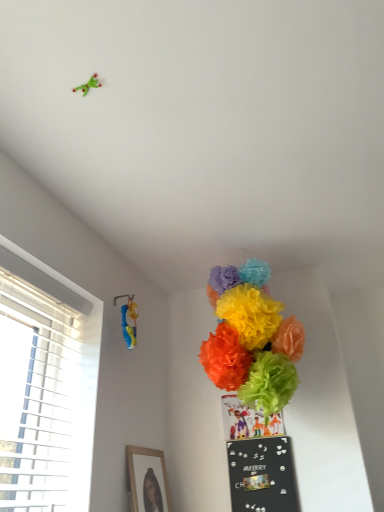
Find the location of a particular element. black matte bulletin board at lower center is located at coordinates (262, 475).

Where is `blue plastic toy at upper left`? The width and height of the screenshot is (384, 512). blue plastic toy at upper left is located at coordinates (131, 318).

Locate an element on the screen. black matte bulletin board at lower center is located at coordinates (262, 475).

Is point (131, 347) positioned behind point (248, 298)?

Yes, it is.

Is bright tissue paper pom-poms at center surrounded by blue plastic toy at upper left?

No, blue plastic toy at upper left does not contain bright tissue paper pom-poms at center.

Between blue plastic toy at upper left and bright tissue paper pom-poms at center, which one has smaller width?

blue plastic toy at upper left.

From a real-world perspective, is blue plastic toy at upper left below bright tissue paper pom-poms at center?

Yes.

Can you confirm if wooden framed picture at lower left is smaller than blue plastic toy at upper left?

No, wooden framed picture at lower left is not smaller than blue plastic toy at upper left.

From a real-world perspective, is wooden framed picture at lower left above or below blue plastic toy at upper left?

In terms of real-world spatial position, wooden framed picture at lower left is below blue plastic toy at upper left.

From the image's perspective, relative to blue plastic toy at upper left, is wooden framed picture at lower left above or below?

wooden framed picture at lower left is below blue plastic toy at upper left.

Considering the relative sizes of wooden framed picture at lower left and blue plastic toy at upper left in the image provided, is wooden framed picture at lower left shorter than blue plastic toy at upper left?

In fact, wooden framed picture at lower left may be taller than blue plastic toy at upper left.

In the scene shown: Between bright tissue paper pom-poms at center and wooden framed picture at lower left, which one has less height?

wooden framed picture at lower left is shorter.

Considering the sizes of bright tissue paper pom-poms at center and wooden framed picture at lower left in the image, is bright tissue paper pom-poms at center bigger or smaller than wooden framed picture at lower left?

Considering their sizes, bright tissue paper pom-poms at center takes up more space than wooden framed picture at lower left.

Is bright tissue paper pom-poms at center situated inside wooden framed picture at lower left or outside?

bright tissue paper pom-poms at center is located beyond the bounds of wooden framed picture at lower left.

Looking at this image, measure the distance between bright tissue paper pom-poms at center and wooden framed picture at lower left.

66.80 centimeters.

Are wooden framed picture at lower left and black matte bulletin board at lower center far apart?

No, wooden framed picture at lower left is not far from black matte bulletin board at lower center.

In terms of height, does wooden framed picture at lower left look taller or shorter compared to black matte bulletin board at lower center?

wooden framed picture at lower left is shorter than black matte bulletin board at lower center.

Based on the photo, from a real-world perspective, between wooden framed picture at lower left and black matte bulletin board at lower center, who is vertically lower?

From a 3D spatial view, black matte bulletin board at lower center is below.

What's the angular difference between wooden framed picture at lower left and black matte bulletin board at lower center's facing directions?

89.7 degrees separate the facing orientations of wooden framed picture at lower left and black matte bulletin board at lower center.

Is the depth of bright tissue paper pom-poms at center less than that of black matte bulletin board at lower center?

Yes, bright tissue paper pom-poms at center is closer to the viewer.

Is bright tissue paper pom-poms at center directly adjacent to black matte bulletin board at lower center?

bright tissue paper pom-poms at center and black matte bulletin board at lower center are not in contact.

Is bright tissue paper pom-poms at center to the left of black matte bulletin board at lower center from the viewer's perspective?

Yes, bright tissue paper pom-poms at center is to the left of black matte bulletin board at lower center.

Considering the relative sizes of bright tissue paper pom-poms at center and black matte bulletin board at lower center in the image provided, is bright tissue paper pom-poms at center thinner than black matte bulletin board at lower center?

Incorrect, the width of bright tissue paper pom-poms at center is not less than that of black matte bulletin board at lower center.

From the image's perspective, is black matte bulletin board at lower center located above wooden framed picture at lower left?

Incorrect, from the image's perspective, black matte bulletin board at lower center is lower than wooden framed picture at lower left.

From a real-world perspective, is black matte bulletin board at lower center physically above wooden framed picture at lower left?

Incorrect, from a real-world perspective, black matte bulletin board at lower center is lower than wooden framed picture at lower left.

Is black matte bulletin board at lower center far from wooden framed picture at lower left?

No.

Is black matte bulletin board at lower center smaller than wooden framed picture at lower left?

Indeed, black matte bulletin board at lower center has a smaller size compared to wooden framed picture at lower left.

Which point is more distant from viewer, (x=115, y=303) or (x=259, y=468)?

The point (x=115, y=303) is farther.

Between blue plastic toy at upper left and black matte bulletin board at lower center, which one has larger size?

Bigger between the two is black matte bulletin board at lower center.

From the picture: Who is taller, blue plastic toy at upper left or black matte bulletin board at lower center?

black matte bulletin board at lower center is taller.

In the scene shown: Considering the relative positions of blue plastic toy at upper left and black matte bulletin board at lower center in the image provided, is blue plastic toy at upper left in front of black matte bulletin board at lower center?

Yes, blue plastic toy at upper left is closer to the camera.

Where is `toy located behind the bright tissue paper pom-poms at center`? This screenshot has width=384, height=512. toy located behind the bright tissue paper pom-poms at center is located at coordinates 131,318.

Locate an element on the screen. Image resolution: width=384 pixels, height=512 pixels. picture frame located in front of the blue plastic toy at upper left is located at coordinates (148, 479).

Considering their positions, is wooden framed picture at lower left positioned closer to blue plastic toy at upper left than bright tissue paper pom-poms at center?

bright tissue paper pom-poms at center lies closer to blue plastic toy at upper left than the other object.

When comparing their distances from wooden framed picture at lower left, does black matte bulletin board at lower center or bright tissue paper pom-poms at center seem further?

Among the two, bright tissue paper pom-poms at center is located further to wooden framed picture at lower left.

Estimate the real-world distances between objects in this image. Which object is further from bright tissue paper pom-poms at center, wooden framed picture at lower left or blue plastic toy at upper left?

wooden framed picture at lower left is further to bright tissue paper pom-poms at center.

From the image, which object appears to be farther from blue plastic toy at upper left, black matte bulletin board at lower center or wooden framed picture at lower left?

black matte bulletin board at lower center lies further to blue plastic toy at upper left than the other object.

Based on their spatial positions, is black matte bulletin board at lower center or wooden framed picture at lower left closer to bright tissue paper pom-poms at center?

black matte bulletin board at lower center is closer to bright tissue paper pom-poms at center.

Estimate the real-world distances between objects in this image. Which object is closer to black matte bulletin board at lower center, wooden framed picture at lower left or blue plastic toy at upper left?

wooden framed picture at lower left.

Considering their positions, is bright tissue paper pom-poms at center positioned closer to wooden framed picture at lower left than black matte bulletin board at lower center?

black matte bulletin board at lower center is positioned closer to the anchor wooden framed picture at lower left.

Which object lies nearer to the anchor point wooden framed picture at lower left, bright tissue paper pom-poms at center or blue plastic toy at upper left?

blue plastic toy at upper left.

The height and width of the screenshot is (512, 384). I want to click on picture frame between blue plastic toy at upper left and black matte bulletin board at lower center in the up-down direction, so click(x=148, y=479).

Locate an element on the screen. picture frame between bright tissue paper pom-poms at center and black matte bulletin board at lower center in the vertical direction is located at coordinates (148, 479).

Where is `toy between bright tissue paper pom-poms at center and wooden framed picture at lower left in the up-down direction`? The width and height of the screenshot is (384, 512). toy between bright tissue paper pom-poms at center and wooden framed picture at lower left in the up-down direction is located at coordinates (131, 318).

Image resolution: width=384 pixels, height=512 pixels. Find the location of `toy between bright tissue paper pom-poms at center and black matte bulletin board at lower center in the up-down direction`. toy between bright tissue paper pom-poms at center and black matte bulletin board at lower center in the up-down direction is located at coordinates (131, 318).